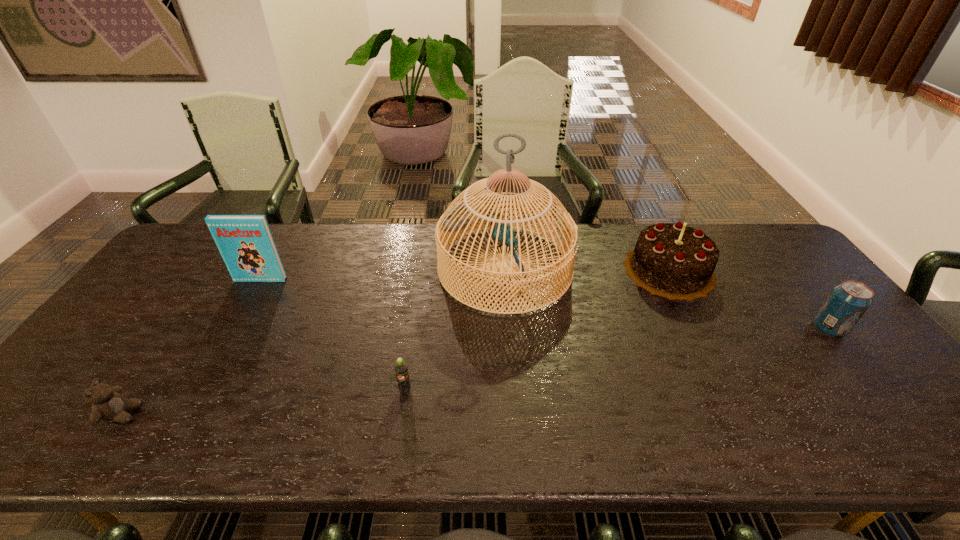
You are a GUI agent. You are given a task and a screenshot of the screen. Output one action in this format:
    pyautogui.click(x=<x>, y=<y>)
    Task: Click on the third object from right to left
    This screenshot has width=960, height=540.
    Given the screenshot: What is the action you would take?
    pyautogui.click(x=455, y=218)

Identify the location of birdcage. (455, 218).

Identify the location of book. This screenshot has width=960, height=540. (245, 242).

Where is `the fifth object from right to left`? the fifth object from right to left is located at coordinates (245, 242).

Identify the location of the fifth object from left to right. The image size is (960, 540). (675, 261).

This screenshot has height=540, width=960. Find the location of `the third tallest object`. the third tallest object is located at coordinates (675, 261).

Identify the location of the right soda. (848, 301).

In order to click on the taller soda in this screenshot , I will do `click(848, 301)`.

Find the location of a particular element. The width and height of the screenshot is (960, 540). the third object from left to right is located at coordinates (401, 368).

Locate an element on the screen. the shorter soda is located at coordinates (401, 368).